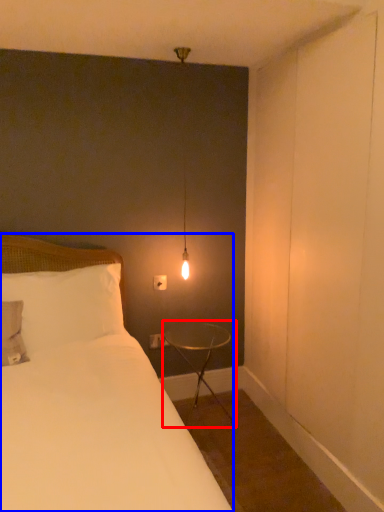
Question: Which object appears closest to the camera in this image, table (highlighted by a red box) or bed (highlighted by a blue box)?

Choices:
 (A) table
 (B) bed

Answer: (B)